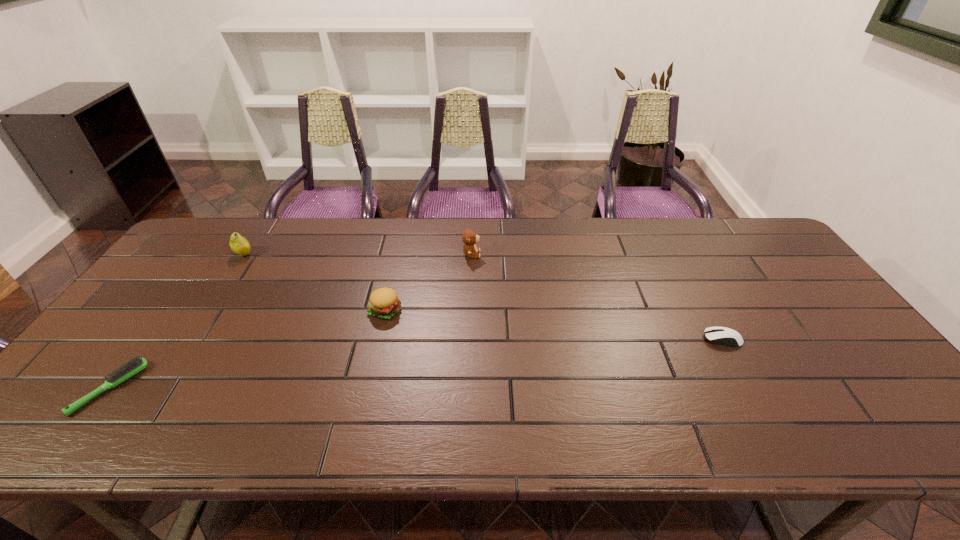
At what (x,y) coordinates should I click in order to perform the action: click on vacant point located between the pear and the hamburger. Please return your answer as a coordinate pair (x, y). This screenshot has height=540, width=960. Looking at the image, I should click on (315, 282).

Identify the location of empty space that is in between the pear and the second nearest object. (483, 296).

The width and height of the screenshot is (960, 540). I want to click on free area in between the fourth object from left to right and the pear, so click(x=358, y=254).

At what (x,y) coordinates should I click in order to perform the action: click on empty space between the mouse and the nearest object. Please return your answer as a coordinate pair (x, y). The width and height of the screenshot is (960, 540). Looking at the image, I should click on (416, 364).

Find the location of `object that is the fourth closest one to the mouse`. object that is the fourth closest one to the mouse is located at coordinates (136, 365).

Find the location of a particular element. This screenshot has height=540, width=960. object identified as the closest to the nearest object is located at coordinates (238, 244).

You are a GUI agent. You are given a task and a screenshot of the screen. Output one action in this format:
    pyautogui.click(x=<x>, y=<y>)
    Task: Click on the free space that satisfies the following two spatial constraints: 1. on the face of the fourth farthest object; 2. on the left side of the fourth object from left to right
    
    Given the screenshot: What is the action you would take?
    pyautogui.click(x=469, y=339)

Where is `vacant space that satisfies the following two spatial constraints: 1. on the face of the teddy bear; 2. on the right side of the rightmost object`? vacant space that satisfies the following two spatial constraints: 1. on the face of the teddy bear; 2. on the right side of the rightmost object is located at coordinates (469, 339).

Identify the location of vacant space that satisfies the following two spatial constraints: 1. on the face of the second object from right to left; 2. on the left side of the mouse. This screenshot has width=960, height=540. (469, 339).

The image size is (960, 540). I want to click on free space that satisfies the following two spatial constraints: 1. on the face of the fourth object from left to right; 2. on the front side of the third farthest object, so click(470, 310).